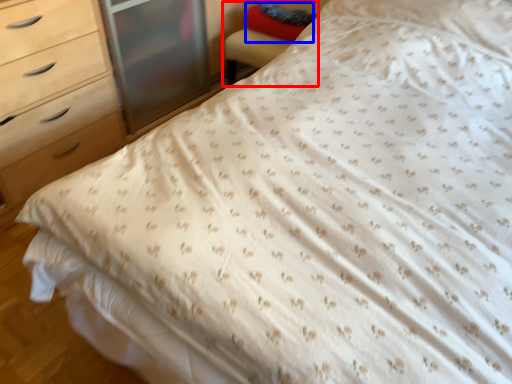
Question: Which object appears closest to the camera in this image, armchair (highlighted by a red box) or pillow (highlighted by a blue box)?

Choices:
 (A) armchair
 (B) pillow

Answer: (A)